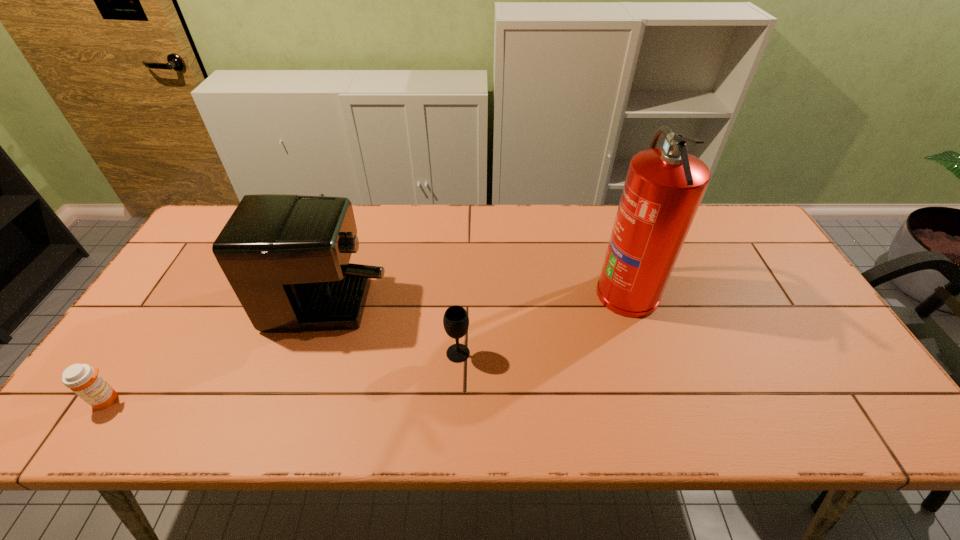
In the image, there is a desktop. Find the location of `free space at the left edge`. free space at the left edge is located at coordinates (107, 381).

You are a GUI agent. You are given a task and a screenshot of the screen. Output one action in this format:
    pyautogui.click(x=<x>, y=<y>)
    Task: Click on the free space at the right edge of the desktop
    
    Given the screenshot: What is the action you would take?
    pyautogui.click(x=774, y=318)

In the image, there is a desktop. Identify the location of free space at the far left corner. This screenshot has height=540, width=960. (224, 211).

The image size is (960, 540). In order to click on vacant area at the near left corner of the desktop in this screenshot , I will do `click(114, 402)`.

Image resolution: width=960 pixels, height=540 pixels. What are the coordinates of `vacant area that lies between the fire extinguisher and the third object from right to left` in the screenshot? It's located at (475, 278).

Where is `vacant space in between the third object from left to right and the third object from right to left`? vacant space in between the third object from left to right and the third object from right to left is located at coordinates (392, 308).

The width and height of the screenshot is (960, 540). What are the coordinates of `unoccupied area between the wineglass and the second object from left to right` in the screenshot? It's located at (392, 308).

This screenshot has height=540, width=960. I want to click on free point between the second object from left to right and the fire extinguisher, so click(x=475, y=278).

Image resolution: width=960 pixels, height=540 pixels. I want to click on vacant area between the third tallest object and the third object from right to left, so click(x=392, y=308).

At what (x,y) coordinates should I click in order to perform the action: click on vacant area that lies between the second nearest object and the rightmost object. Please return your answer as a coordinate pair (x, y). The height and width of the screenshot is (540, 960). Looking at the image, I should click on (542, 322).